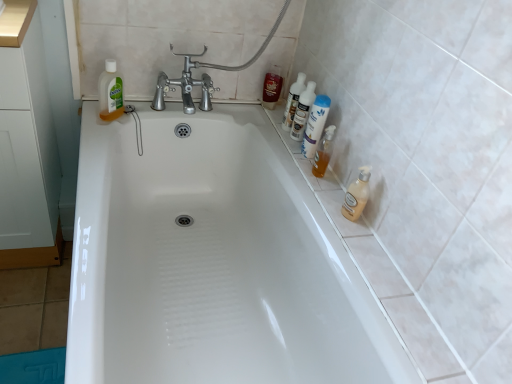
You are a GUI agent. You are given a task and a screenshot of the screen. Output one action in this format:
    pyautogui.click(x=<x>, y=<y>)
    Task: Click on the free spot to the right of translucent plastic bottle at upper left, the first cleaning product when ordered from left to right
    The image size is (512, 384).
    Given the screenshot: What is the action you would take?
    pyautogui.click(x=148, y=109)